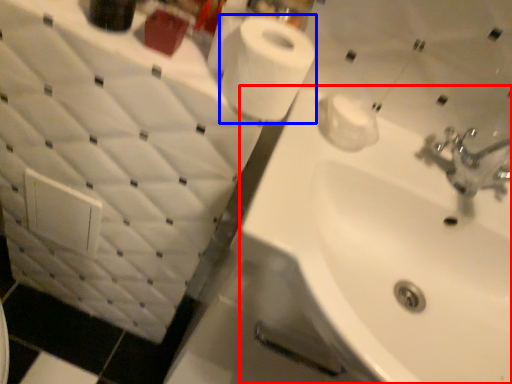
Question: Among these objects, which one is nearest to the camera, sink (highlighted by a red box) or toilet paper (highlighted by a blue box)?

Choices:
 (A) sink
 (B) toilet paper

Answer: (B)